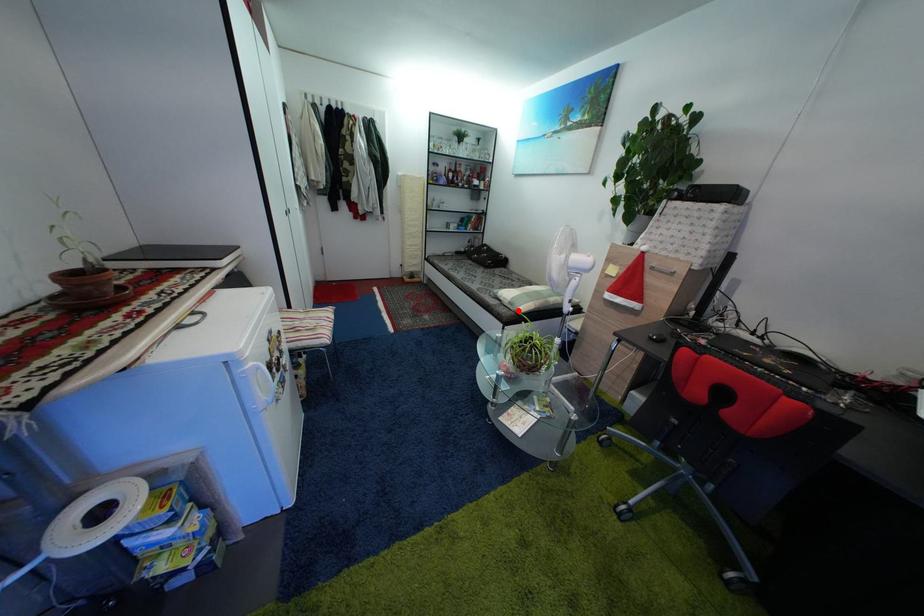
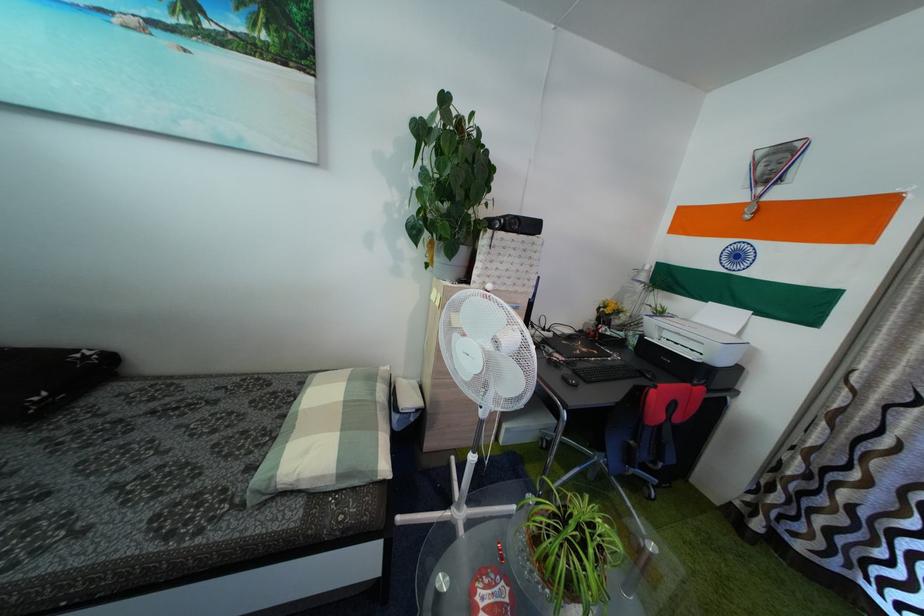
Where in the second image is the point corresponding to the highlighted location from the first image?

(347, 483)